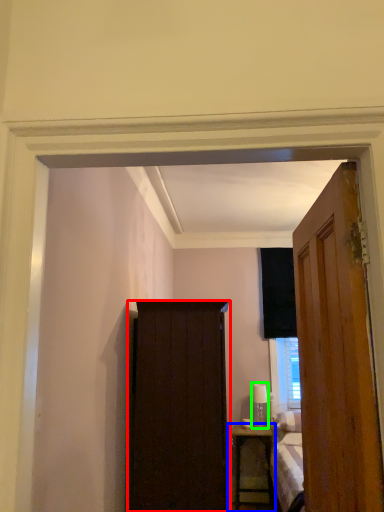
Question: Which is farther away from screen door (highlighted by a red box)? nightstand (highlighted by a blue box) or lamp (highlighted by a green box)?

Choices:
 (A) nightstand
 (B) lamp

Answer: (B)